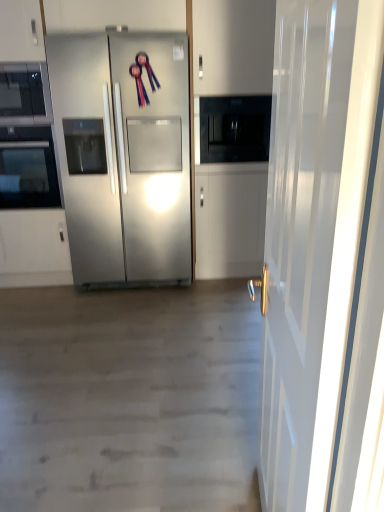
Question: Should I look upward or downward to see stainless steel refrigerator at center?

Choices:
 (A) up
 (B) down

Answer: (A)

Question: From a real-world perspective, is stainless steel refrigerator at center under matte black microwave at upper left?

Choices:
 (A) no
 (B) yes

Answer: (B)

Question: Considering the relative sizes of stainless steel refrigerator at center and matte black microwave at upper left in the image provided, is stainless steel refrigerator at center taller than matte black microwave at upper left?

Choices:
 (A) yes
 (B) no

Answer: (A)

Question: Is stainless steel refrigerator at center behind matte black microwave at upper left?

Choices:
 (A) no
 (B) yes

Answer: (A)

Question: Is stainless steel refrigerator at center positioned before matte black microwave at upper left?

Choices:
 (A) no
 (B) yes

Answer: (B)

Question: Does stainless steel refrigerator at center appear on the left side of matte black microwave at upper left?

Choices:
 (A) yes
 (B) no

Answer: (B)

Question: Can we say stainless steel refrigerator at center lies outside matte black microwave at upper left?

Choices:
 (A) yes
 (B) no

Answer: (A)

Question: Is stainless steel refrigerator at center smaller than white glossy door at right?

Choices:
 (A) no
 (B) yes

Answer: (A)

Question: From the image's perspective, is stainless steel refrigerator at center on white glossy door at right?

Choices:
 (A) no
 (B) yes

Answer: (B)

Question: Considering the relative sizes of stainless steel refrigerator at center and white glossy door at right in the image provided, is stainless steel refrigerator at center shorter than white glossy door at right?

Choices:
 (A) no
 (B) yes

Answer: (A)

Question: Considering the relative sizes of stainless steel refrigerator at center and white glossy door at right in the image provided, is stainless steel refrigerator at center bigger than white glossy door at right?

Choices:
 (A) no
 (B) yes

Answer: (B)

Question: From a real-world perspective, is stainless steel refrigerator at center positioned over white glossy door at right based on gravity?

Choices:
 (A) no
 (B) yes

Answer: (B)

Question: From a real-world perspective, is stainless steel refrigerator at center under white glossy door at right?

Choices:
 (A) no
 (B) yes

Answer: (A)

Question: Considering the relative positions of matte black microwave at upper left and black glass oven at left in the image provided, is matte black microwave at upper left to the left of black glass oven at left from the viewer's perspective?

Choices:
 (A) yes
 (B) no

Answer: (B)